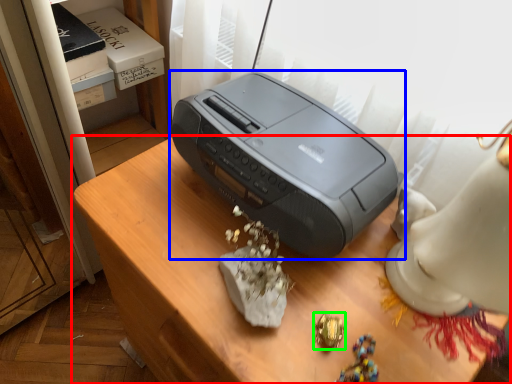
Question: Which object is the farthest from furniture (highlighted by a red box)? Choose among these: printer (highlighted by a blue box) or jewellery (highlighted by a green box).

Choices:
 (A) printer
 (B) jewellery

Answer: (B)